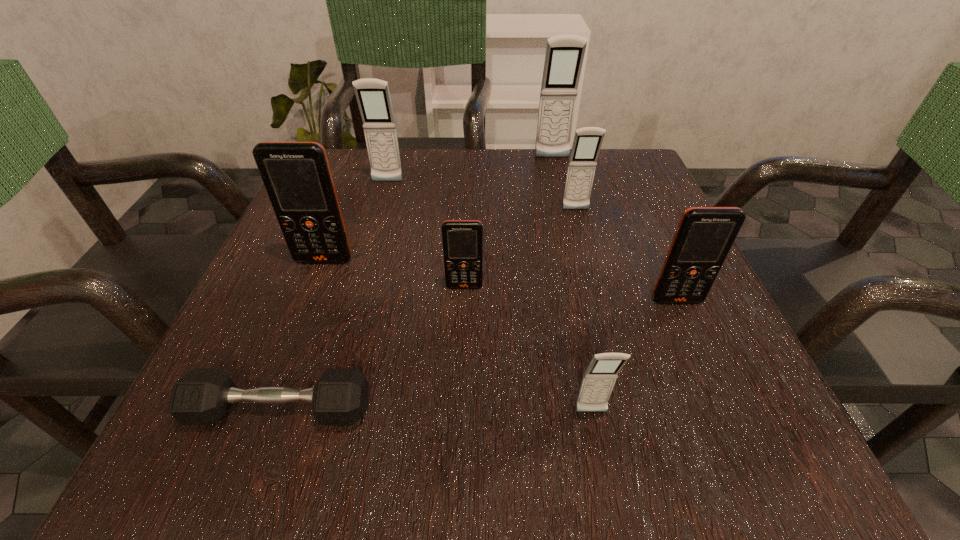
Where is `free spot located on the screen of the second orange cellular telephone from right to left`? Image resolution: width=960 pixels, height=540 pixels. free spot located on the screen of the second orange cellular telephone from right to left is located at coordinates (463, 339).

This screenshot has width=960, height=540. I want to click on vacant area situated 0.070m on the front-facing side of the nearest gray cellular telephone, so click(x=603, y=474).

Where is `free region located 0.190m on the back of the dumbbell`? This screenshot has height=540, width=960. free region located 0.190m on the back of the dumbbell is located at coordinates (324, 288).

Locate an element on the screen. The image size is (960, 540). cellular telephone that is positioned at the near edge is located at coordinates (598, 381).

You are a GUI agent. You are given a task and a screenshot of the screen. Output one action in this format:
    pyautogui.click(x=<x>, y=<y>)
    Task: Click on the dumbbell that is at the near edge
    
    Given the screenshot: What is the action you would take?
    pyautogui.click(x=202, y=396)

At what (x,y) coordinates should I click in order to perform the action: click on dumbbell positioned at the left edge. Please return your answer as a coordinate pair (x, y). Looking at the image, I should click on (202, 396).

The image size is (960, 540). I want to click on object present at the far left corner, so click(373, 97).

Image resolution: width=960 pixels, height=540 pixels. Find the location of `object that is at the near left corner`. object that is at the near left corner is located at coordinates (202, 396).

The height and width of the screenshot is (540, 960). Find the location of `object at the far right corner`. object at the far right corner is located at coordinates [x=587, y=142].

The width and height of the screenshot is (960, 540). What are the coordinates of `vacant space at the far edge of the desktop` in the screenshot? It's located at (408, 171).